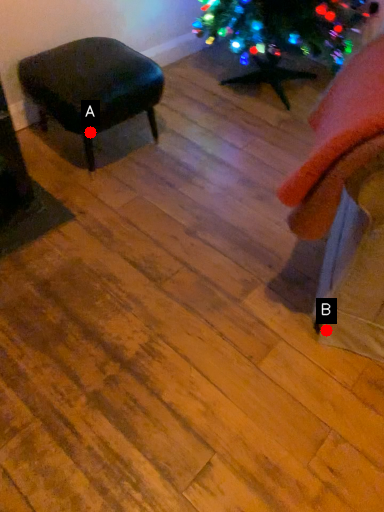
Question: Two points are circled on the image, labeled by A and B beside each circle. Which point appears farthest from the camera in this image?

Choices:
 (A) A is further
 (B) B is further

Answer: (A)